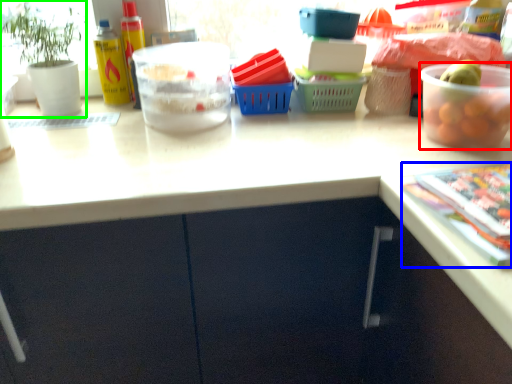
Question: Which object is the closest to the bowl (highlighted by a red box)? Choose among these: magazine (highlighted by a blue box) or houseplant (highlighted by a green box).

Choices:
 (A) magazine
 (B) houseplant

Answer: (A)